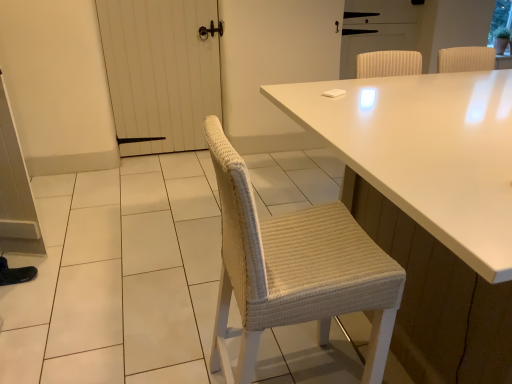
Question: From a real-world perspective, relative to white ribbed screen door at upper center, acting as the 1th screen door starting from the right, is white wooden door at left, the first screen door in the left-to-right sequence, vertically above or below?

Choices:
 (A) below
 (B) above

Answer: (A)

Question: Is white wooden door at left, arranged as the 2th screen door when viewed from the right, wider or thinner than white ribbed screen door at upper center, the 2th screen door positioned from the left?

Choices:
 (A) wide
 (B) thin

Answer: (A)

Question: Estimate the real-world distances between objects in this image. Which object is farther from the white wooden door at left, the first screen door in the left-to-right sequence?

Choices:
 (A) white glossy table at center
 (B) white ribbed screen door at upper center, the 2th screen door positioned from the left

Answer: (A)

Question: Which object is positioned farthest from the white ribbed screen door at upper center, the 2th screen door positioned from the left?

Choices:
 (A) white glossy table at center
 (B) white wooden door at left, the first screen door in the left-to-right sequence

Answer: (A)